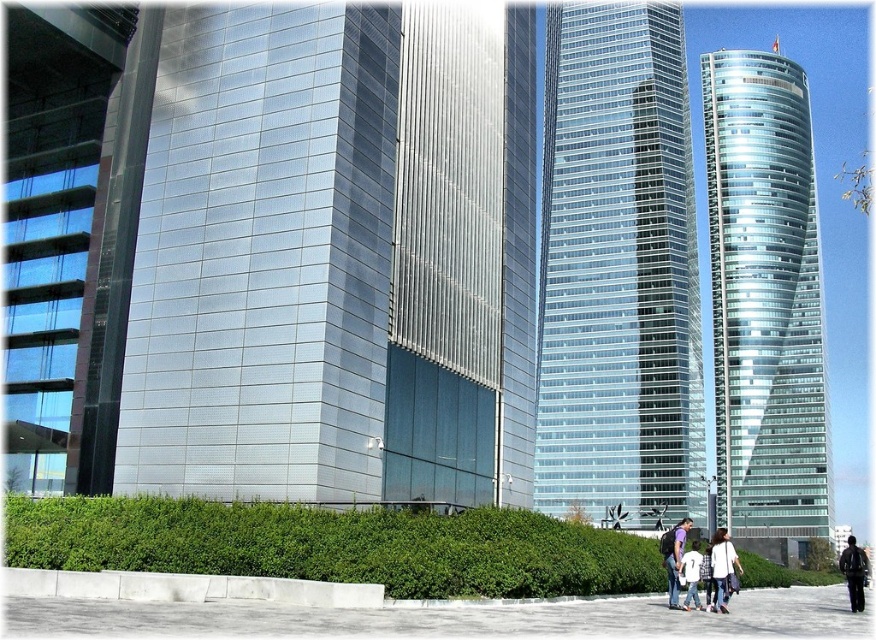
You are standing at the origin point in the urban landscape and want to take a photo of the white matte shirt at center. According to the coordinates provided, in which direction should you move to capture the shirt in your camera frame?

The white matte shirt at center is located at point 0.887 on the x and 0.825 on the y. Since the origin is at the bottom left corner, you should move northeast to reach it.

You are a photographer standing in the urban landscape. You want to capture a photo that includes both the dark blue jeans at lower right and the white cotton shirt at center. Which object should you adjust your camera angle to focus on first to ensure both are in the frame?

You should focus on the white cotton shirt at center first because it is behind the dark blue jeans at lower right, so adjusting the angle to include the background object ensures both are visible.

You are a photographer standing in the urban landscape and want to capture both the white matte shirt at center and the dark blue jeans at lower right in a single shot. Which object will appear larger in your photo?

The white matte shirt at center will appear larger in the photo because it is closer to the viewer than the dark blue jeans at lower right.